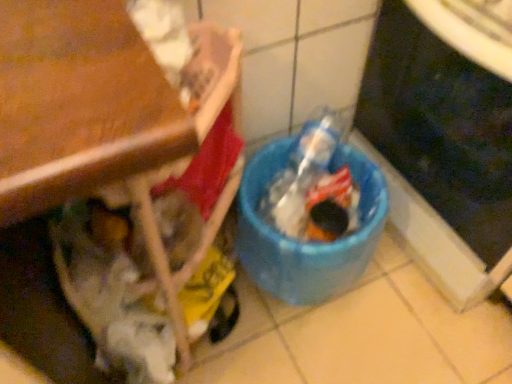
Question: Should I look upward or downward to see blue plastic trash can at lower right?

Choices:
 (A) down
 (B) up

Answer: (B)

Question: Considering the relative sizes of blue plastic bucket at lower center and blue plastic trash can at lower right in the image provided, is blue plastic bucket at lower center wider than blue plastic trash can at lower right?

Choices:
 (A) no
 (B) yes

Answer: (A)

Question: From a real-world perspective, is blue plastic bucket at lower center physically below blue plastic trash can at lower right?

Choices:
 (A) yes
 (B) no

Answer: (A)

Question: Does blue plastic bucket at lower center appear on the right side of blue plastic trash can at lower right?

Choices:
 (A) yes
 (B) no

Answer: (B)

Question: Is blue plastic bucket at lower center placed right next to blue plastic trash can at lower right?

Choices:
 (A) yes
 (B) no

Answer: (B)

Question: Does blue plastic bucket at lower center turn towards blue plastic trash can at lower right?

Choices:
 (A) yes
 (B) no

Answer: (B)

Question: From a real-world perspective, is blue plastic bucket at lower center positioned over blue plastic trash can at lower right based on gravity?

Choices:
 (A) yes
 (B) no

Answer: (B)

Question: Is blue plastic trash can at lower right directly adjacent to blue plastic bucket at lower center?

Choices:
 (A) yes
 (B) no

Answer: (B)

Question: Is blue plastic bucket at lower center located within blue plastic trash can at lower right?

Choices:
 (A) yes
 (B) no

Answer: (B)

Question: Is blue plastic trash can at lower right bigger than blue plastic bucket at lower center?

Choices:
 (A) no
 (B) yes

Answer: (B)

Question: Is blue plastic trash can at lower right smaller than blue plastic bucket at lower center?

Choices:
 (A) yes
 (B) no

Answer: (B)

Question: Would you say blue plastic trash can at lower right is outside blue plastic bucket at lower center?

Choices:
 (A) no
 (B) yes

Answer: (B)

Question: Is blue plastic trash can at lower right taller than blue plastic bucket at lower center?

Choices:
 (A) yes
 (B) no

Answer: (A)

Question: Relative to blue plastic trash can at lower right, is blue plastic bucket at lower center in front or behind?

Choices:
 (A) behind
 (B) front

Answer: (A)